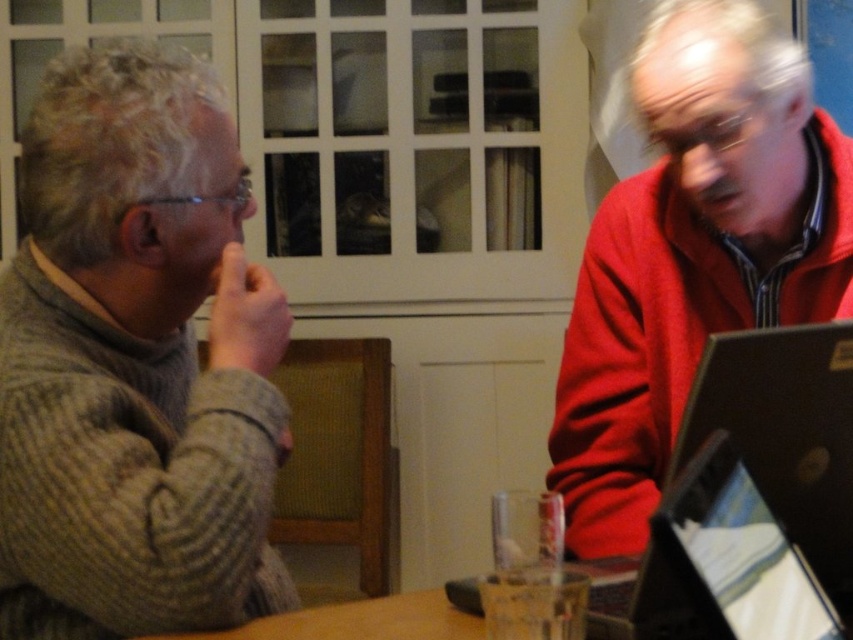
Where is the knitted gray sweater at left located in the image?

The knitted gray sweater at left is located at point [135,362] in the image.

You are a photographer setting up a shoot in the scene described. You want to ensure both the knitted gray sweater at left and the red fleece jacket at right are clearly visible in the photo. Based on their positions, which one is closer to the camera?

The knitted gray sweater at left is in front of the red fleece jacket at right, so it is closer to the camera and will be more visible in the photo.

You are designing a new clothing line and need to determine which fabric requires more material. Based on the image, which garment has a larger size between the knitted gray sweater at left and the red fleece jacket at right?

The knitted gray sweater at left is larger in size than the red fleece jacket at right, so it requires more fabric.